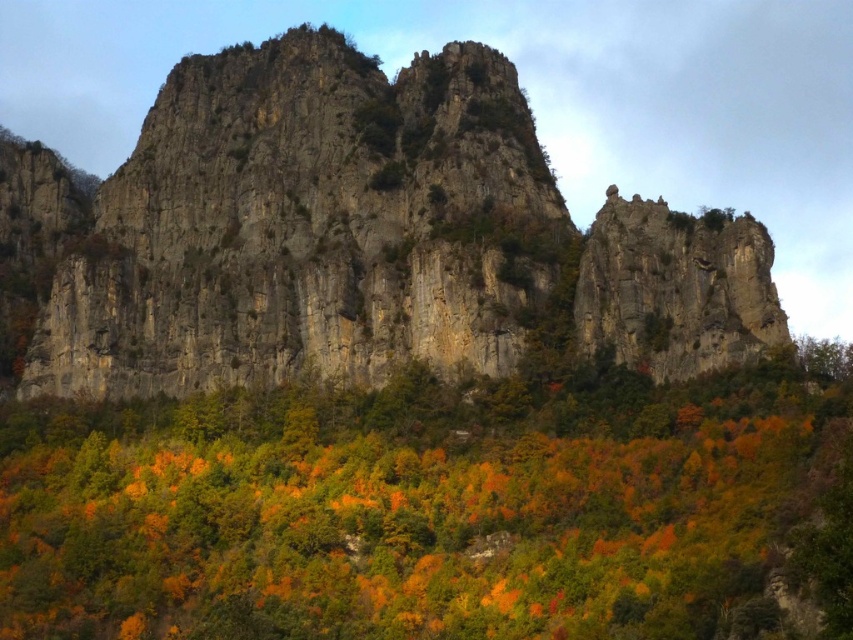
Identify the location of orange matte tree at center. (436, 508).

Does point (601, 486) come in front of point (51, 340)?

Yes, point (601, 486) is in front of point (51, 340).

Between point (585, 563) and point (338, 147), which one is positioned behind?

Positioned behind is point (338, 147).

Where is `orange matte tree at center`? This screenshot has height=640, width=853. orange matte tree at center is located at coordinates (436, 508).